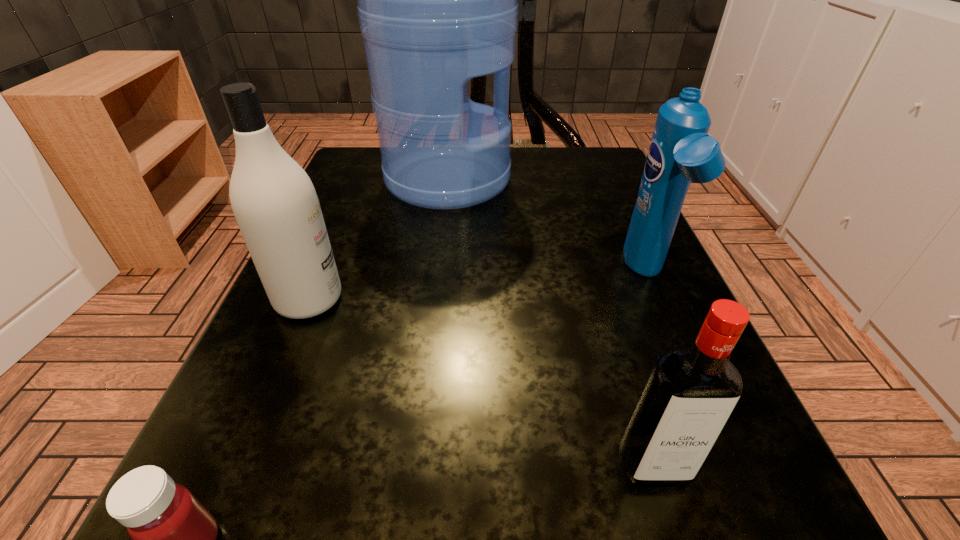
Where is `the farthest object`? The image size is (960, 540). the farthest object is located at coordinates (x=437, y=0).

Locate an element on the screen. The image size is (960, 540). water jug is located at coordinates (437, 0).

Find the location of a particular element. the left shampoo is located at coordinates (274, 201).

Find the location of `the right shampoo`. the right shampoo is located at coordinates (681, 151).

Where is `vodka`? Image resolution: width=960 pixels, height=540 pixels. vodka is located at coordinates (690, 393).

You are a GUI agent. You are given a task and a screenshot of the screen. Output one action in this format:
    pyautogui.click(x=<x>, y=<y>)
    Task: Click on the second shortest object
    This screenshot has height=540, width=960.
    Given the screenshot: What is the action you would take?
    pyautogui.click(x=690, y=393)

Locate an element on the screen. vacant region located on the side of the third object from right to left with the handle is located at coordinates (535, 179).

This screenshot has width=960, height=540. I want to click on free region located on the front-facing side of the left shampoo, so click(x=545, y=299).

Where is `vacant point located 0.090m on the left of the right shampoo`? The image size is (960, 540). vacant point located 0.090m on the left of the right shampoo is located at coordinates click(x=568, y=274).

Where is `object situated at the far edge`? This screenshot has width=960, height=540. object situated at the far edge is located at coordinates (437, 0).